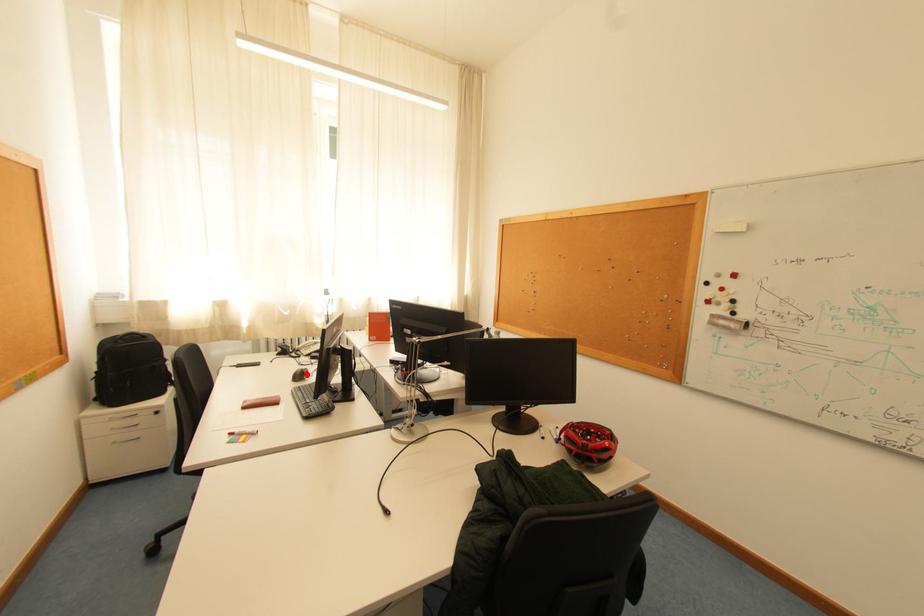
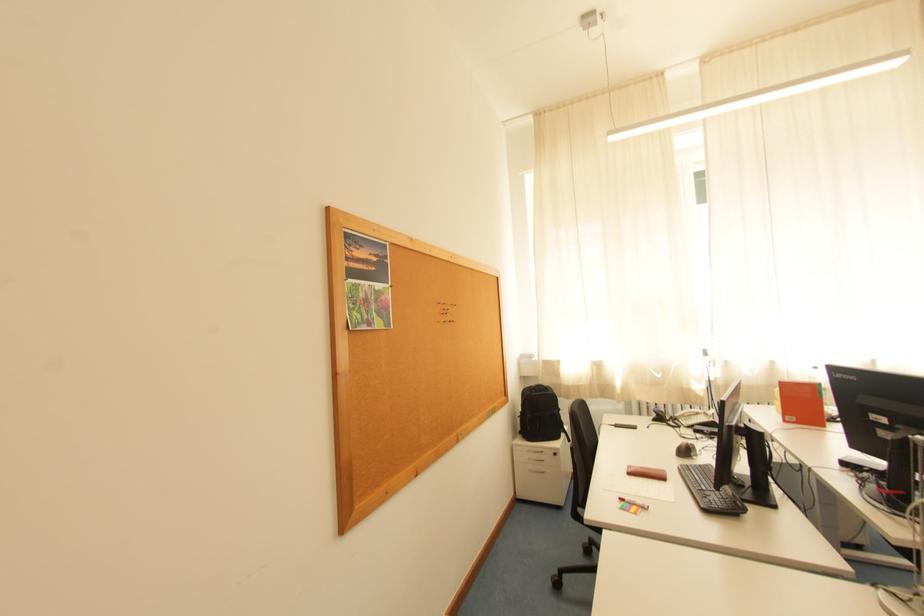
Where in the second image is the point corresponding to the highlighted location from the first image?

(691, 448)